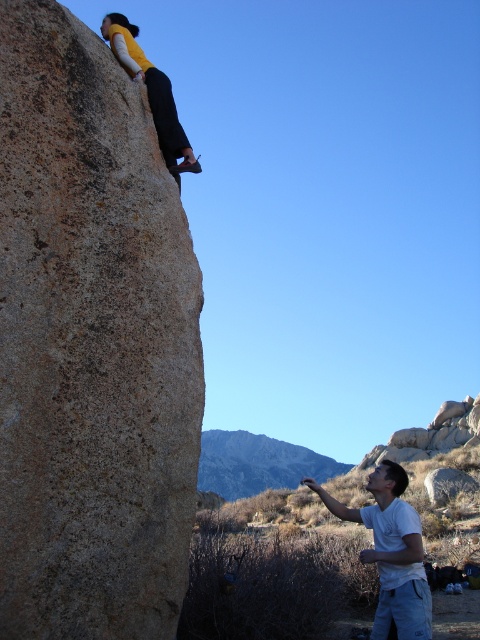
Based on the photo, you are a hiker who has just arrived at the scene and wants to place your backpack on the ground near the white cotton shirt at lower right and the smooth gray rock at lower right. Which object should you place your backpack next to if you want it to be closer to the larger object?

The white cotton shirt at lower right is bigger than the smooth gray rock at lower right. Therefore, you should place your backpack next to the white cotton shirt at lower right to be closer to the larger object.

In the scene shown: You are a hiker looking at the rock climbing scene. You see the matte yellow shirt at upper center and the smooth gray rock at lower right. Which object is positioned higher in the image?

The matte yellow shirt at upper center is positioned higher than the smooth gray rock at lower right.